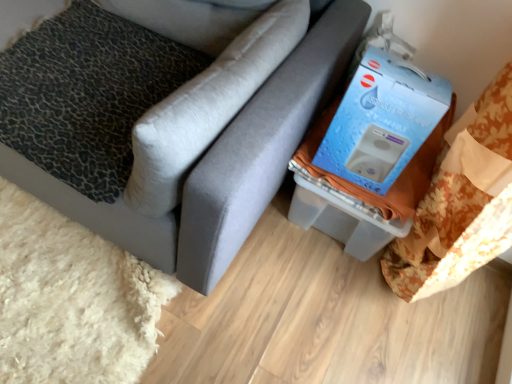
Question: Considering the relative sizes of blue cardboard box at upper right and leopard print fabric pillow at left, which is the 2th pillow in right-to-left order, in the image provided, is blue cardboard box at upper right wider than leopard print fabric pillow at left, which is the 2th pillow in right-to-left order,?

Choices:
 (A) yes
 (B) no

Answer: (B)

Question: Does blue cardboard box at upper right have a larger size compared to leopard print fabric pillow at left, which is the 2th pillow in right-to-left order?

Choices:
 (A) no
 (B) yes

Answer: (A)

Question: Is leopard print fabric pillow at left, the first pillow in the left-to-right sequence, a part of blue cardboard box at upper right?

Choices:
 (A) yes
 (B) no

Answer: (B)

Question: Could you tell me if blue cardboard box at upper right is turned towards leopard print fabric pillow at left, which is the 2th pillow in right-to-left order?

Choices:
 (A) no
 (B) yes

Answer: (A)

Question: Can you confirm if blue cardboard box at upper right is positioned to the right of leopard print fabric pillow at left, which is the 2th pillow in right-to-left order?

Choices:
 (A) yes
 (B) no

Answer: (A)

Question: In terms of size, does matte gray couch at center appear bigger or smaller than leopard print fabric pillow at left, the first pillow in the left-to-right sequence?

Choices:
 (A) big
 (B) small

Answer: (A)

Question: From the image's perspective, is matte gray couch at center located above or below leopard print fabric pillow at left, the first pillow in the left-to-right sequence?

Choices:
 (A) above
 (B) below

Answer: (A)

Question: From a real-world perspective, is matte gray couch at center positioned above or below leopard print fabric pillow at left, which is the 2th pillow in right-to-left order?

Choices:
 (A) above
 (B) below

Answer: (A)

Question: From their relative heights in the image, would you say matte gray couch at center is taller or shorter than leopard print fabric pillow at left, the first pillow in the left-to-right sequence?

Choices:
 (A) short
 (B) tall

Answer: (B)

Question: Is leopard print fabric pillow at left, the first pillow in the left-to-right sequence, situated inside matte gray couch at center or outside?

Choices:
 (A) outside
 (B) inside

Answer: (B)

Question: In the image, is leopard print fabric pillow at left, the first pillow in the left-to-right sequence, positioned in front of or behind matte gray couch at center?

Choices:
 (A) front
 (B) behind

Answer: (B)

Question: Is leopard print fabric pillow at left, the first pillow in the left-to-right sequence, to the left or to the right of matte gray couch at center in the image?

Choices:
 (A) right
 (B) left

Answer: (A)

Question: From a real-world perspective, is leopard print fabric pillow at left, which is the 2th pillow in right-to-left order, physically located above or below matte gray couch at center?

Choices:
 (A) above
 (B) below

Answer: (B)

Question: From a real-world perspective, is matte gray couch at center physically located above or below blue cardboard box at upper right?

Choices:
 (A) above
 (B) below

Answer: (B)

Question: In terms of height, does matte gray couch at center look taller or shorter compared to blue cardboard box at upper right?

Choices:
 (A) tall
 (B) short

Answer: (A)